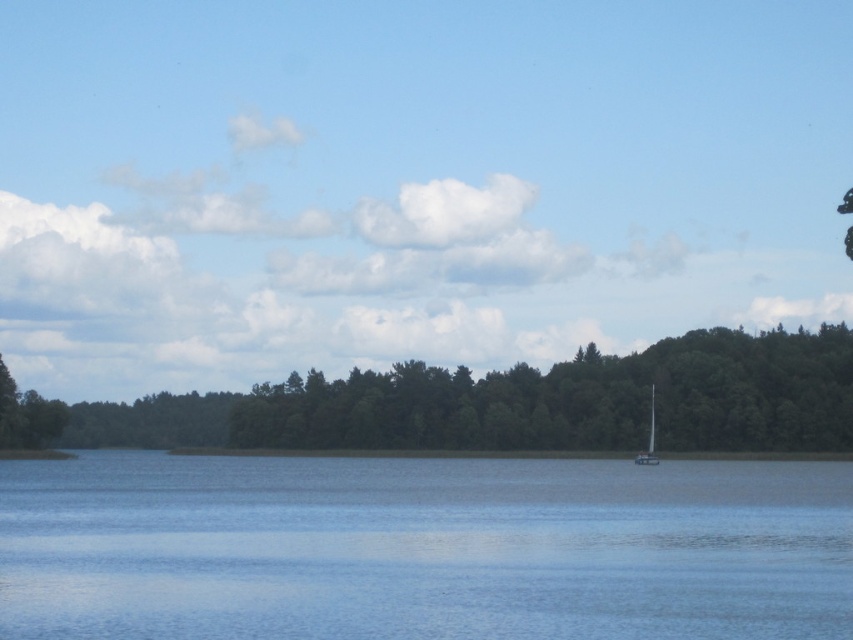
Question: Does transparent blue water at center have a larger size compared to white glossy sailboat at center-right?

Choices:
 (A) yes
 (B) no

Answer: (A)

Question: Estimate the real-world distances between objects in this image. Which object is farther from the green leafy trees at center?

Choices:
 (A) white glossy sailboat at center-right
 (B) transparent blue water at center

Answer: (B)

Question: Estimate the real-world distances between objects in this image. Which object is farther from the white glossy sailboat at center-right?

Choices:
 (A) transparent blue water at center
 (B) green leafy trees at center

Answer: (A)

Question: Can you confirm if transparent blue water at center is bigger than green leafy trees at center?

Choices:
 (A) yes
 (B) no

Answer: (B)

Question: Does transparent blue water at center appear under green leafy trees at center?

Choices:
 (A) yes
 (B) no

Answer: (B)

Question: Which point is farther to the camera?

Choices:
 (A) white glossy sailboat at center-right
 (B) green leafy trees at center
 (C) transparent blue water at center

Answer: (B)